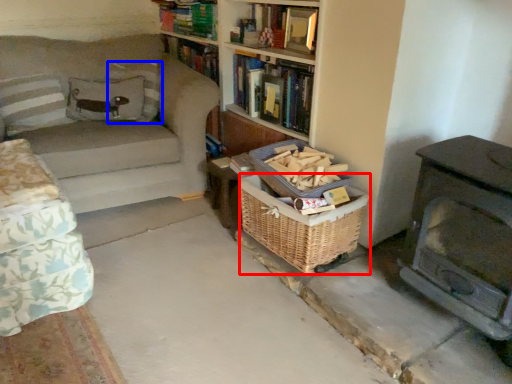
Question: Among these objects, which one is nearest to the camera, basket (highlighted by a red box) or pillow (highlighted by a blue box)?

Choices:
 (A) basket
 (B) pillow

Answer: (A)